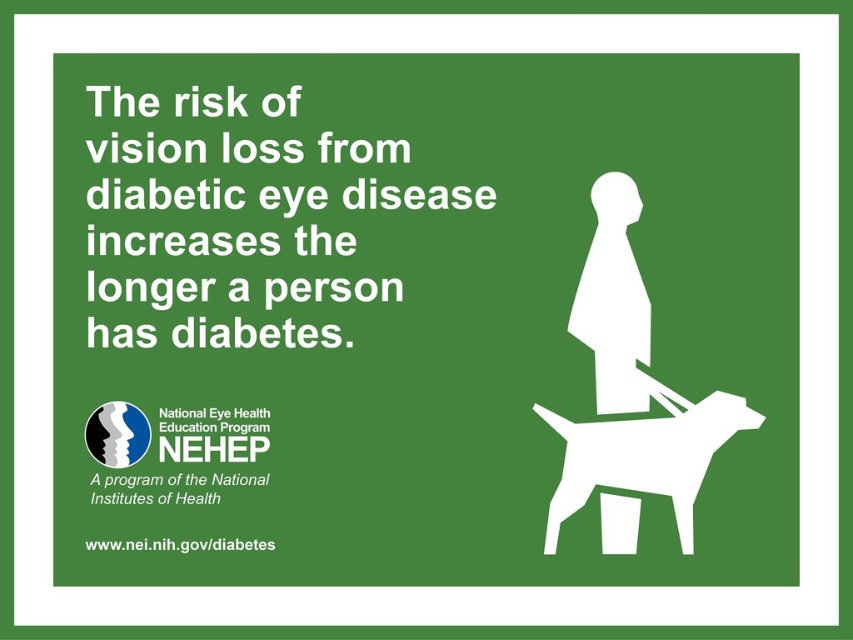
This screenshot has height=640, width=853. I want to click on white matte dog at lower right, so click(x=643, y=456).

Is white matte dog at lower right above white matte figure at center?

Incorrect, white matte dog at lower right is not positioned above white matte figure at center.

The image size is (853, 640). What do you see at coordinates (643, 456) in the screenshot?
I see `white matte dog at lower right` at bounding box center [643, 456].

Identify the location of white matte dog at lower right. (643, 456).